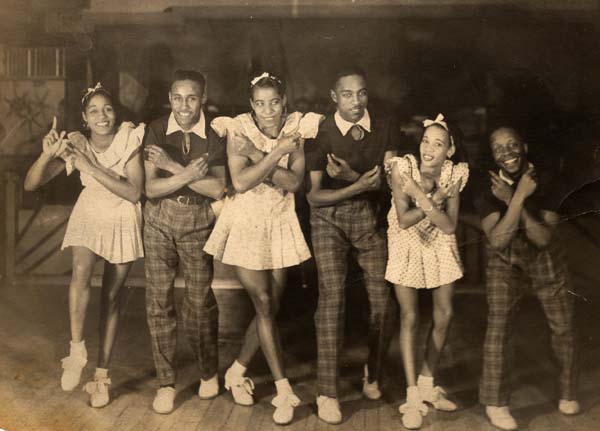
The width and height of the screenshot is (600, 431). Identify the location of ceiling. (321, 8).